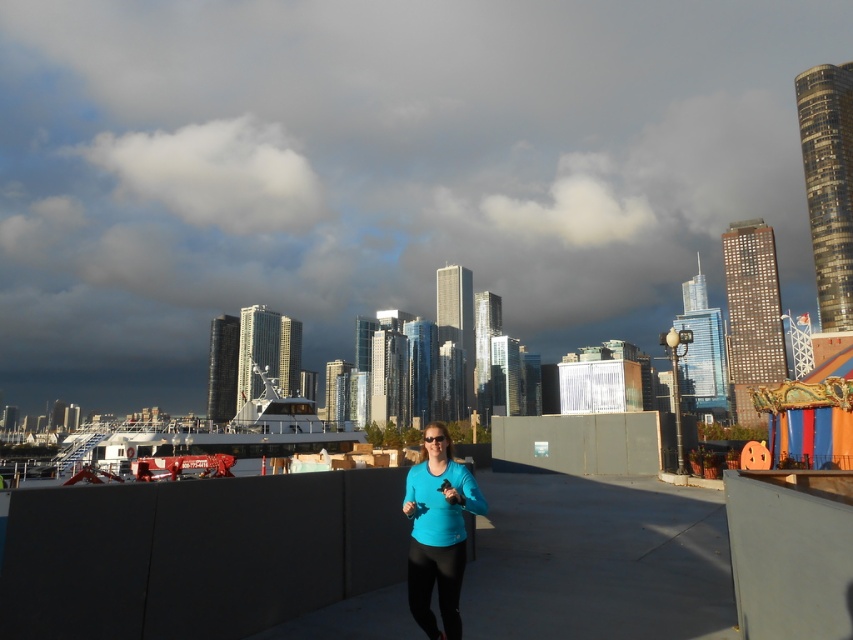
Question: Can you confirm if white fluffy cloud at upper left is positioned below blue matte shirt at center?

Choices:
 (A) no
 (B) yes

Answer: (A)

Question: Which object appears farthest from the camera in this image?

Choices:
 (A) blue matte shirt at center
 (B) white fluffy cloud at upper left

Answer: (B)

Question: Which of the following is the closest to the observer?

Choices:
 (A) white fluffy cloud at upper left
 (B) blue matte shirt at center

Answer: (B)

Question: Observing the image, what is the correct spatial positioning of white fluffy cloud at upper left in reference to blue matte shirt at center?

Choices:
 (A) left
 (B) right

Answer: (A)

Question: Can you confirm if white fluffy cloud at upper left is wider than blue matte shirt at center?

Choices:
 (A) no
 (B) yes

Answer: (B)